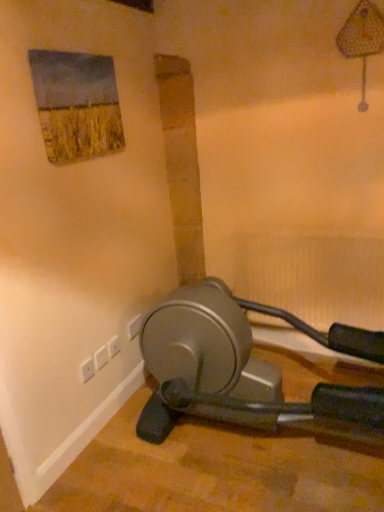
Question: Is white plastic electric outlet at lower left, which is the first electric outlet in front-to-back order, taller or shorter than white plastic electric outlet at lower left, acting as the 1th electric outlet starting from the back?

Choices:
 (A) short
 (B) tall

Answer: (A)

Question: From the image's perspective, is white plastic electric outlet at lower left, the third electric outlet positioned from the right, positioned above or below white plastic electric outlet at lower left, which appears as the 3th electric outlet when viewed from the front?

Choices:
 (A) below
 (B) above

Answer: (A)

Question: Estimate the real-world distances between objects in this image. Which object is farther from the white plastic plug at lower left?

Choices:
 (A) white plastic electric outlet at lower left, which is the first electric outlet in front-to-back order
 (B) white plastic electric outlet at lower left, marked as the 2th electric outlet in a right-to-left arrangement
 (C) white plastic electric outlet at lower left, acting as the 1th electric outlet starting from the back

Answer: (C)

Question: Which of these objects is positioned farthest from the white plastic electric outlet at lower left, which appears as the 3th electric outlet when viewed from the front?

Choices:
 (A) white plastic electric outlet at lower left, the first electric outlet when ordered from left to right
 (B) white plastic electric outlet at lower left, the second electric outlet in the back-to-front sequence
 (C) white plastic plug at lower left

Answer: (A)